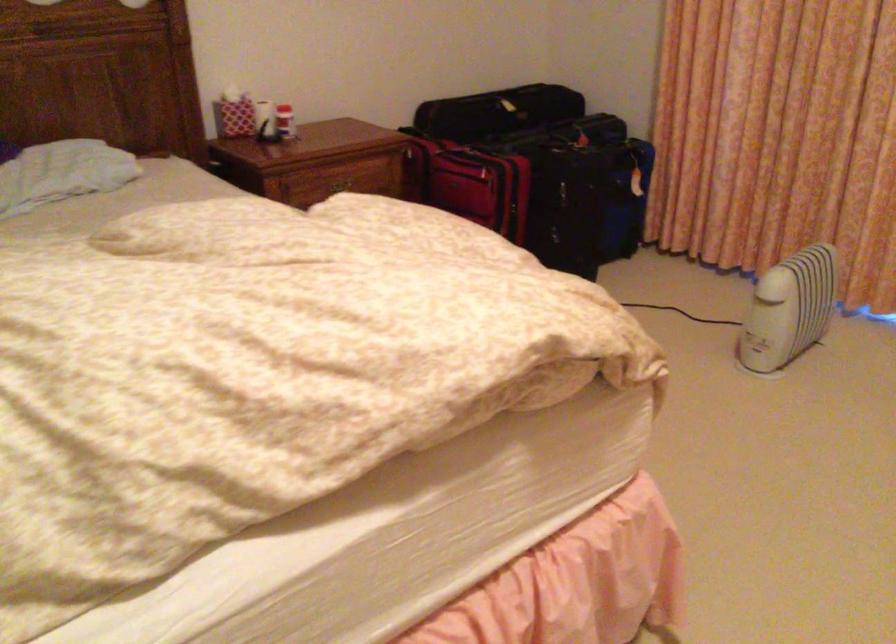
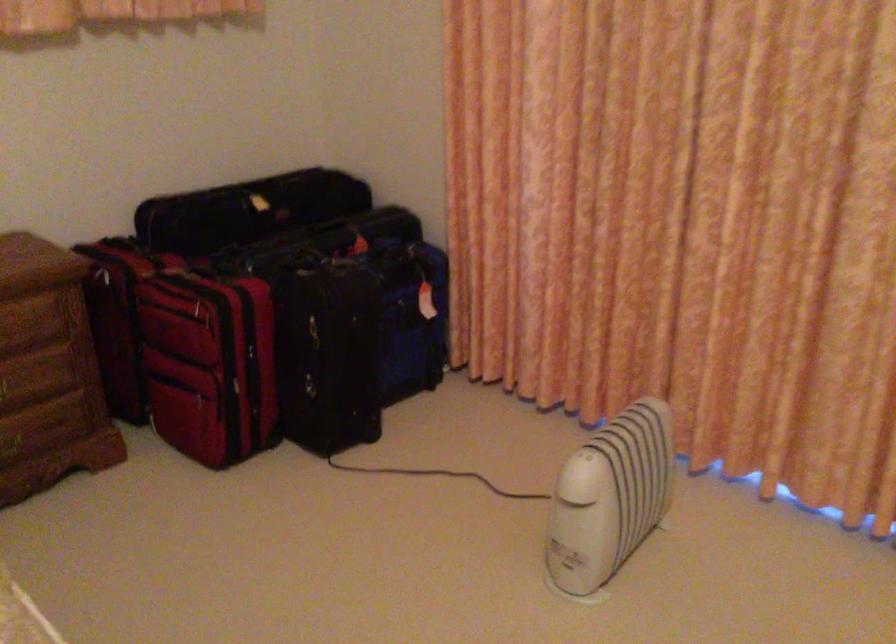
Question: I am providing you with two images of the same scene from different viewpoints. Which of the following objects are not visible in image2?

Choices:
 (A) zipper pull
 (B) wooden drawer handle
 (C) black case handle
 (D) none of these

Answer: (D)